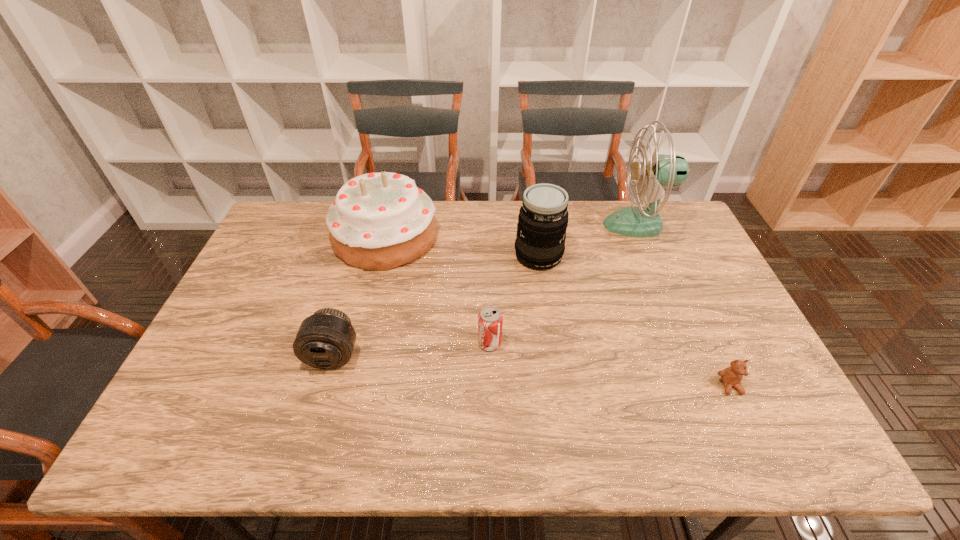
Locate an element on the screen. The width and height of the screenshot is (960, 540). free space located in front of the tallest object, directing airflow is located at coordinates (493, 225).

At what (x,y) coordinates should I click in order to perform the action: click on vacant space located 0.300m in front of the tallest object, directing airflow. Please return your answer as a coordinate pair (x, y). Looking at the image, I should click on (516, 225).

This screenshot has width=960, height=540. Find the location of `vacant space located on the right of the cake`. vacant space located on the right of the cake is located at coordinates (462, 237).

You are a GUI agent. You are given a task and a screenshot of the screen. Output one action in this format:
    pyautogui.click(x=<x>, y=<y>)
    Task: Click on the free space located 0.230m on the front of the right telephoto lens
    
    Given the screenshot: What is the action you would take?
    pyautogui.click(x=549, y=331)

This screenshot has width=960, height=540. Find the location of `vacant position located 0.060m on the front-facing side of the left telephoto lens`. vacant position located 0.060m on the front-facing side of the left telephoto lens is located at coordinates (321, 396).

Identify the location of vacant space located on the front of the soda can. (492, 438).

The image size is (960, 540). I want to click on free space located on the face of the teddy bear, so click(754, 436).

At what (x,y) coordinates should I click in order to perform the action: click on fan at the far edge. Please return your answer as a coordinate pair (x, y). Looking at the image, I should click on [662, 170].

This screenshot has height=540, width=960. I want to click on cake that is at the far edge, so click(x=379, y=221).

Find the location of a particular element. The width and height of the screenshot is (960, 540). telephoto lens present at the far edge is located at coordinates (543, 217).